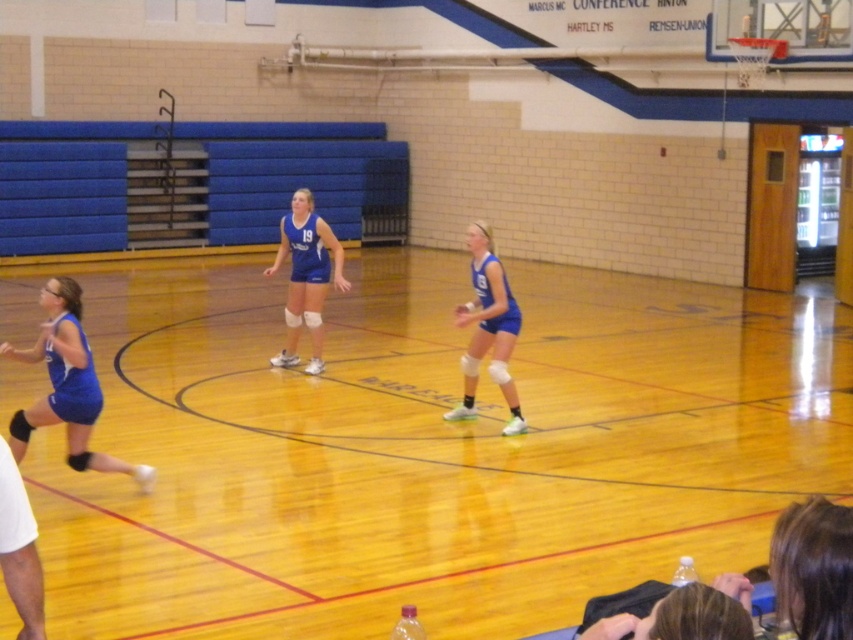
In the gymnasium where the volleyball game is happening, you notice two items of clothing. The first is the matte blue shorts at left, and the second is the blue matte volleyball uniform at center. Which of these items is wider?

The matte blue shorts at left is wider than the blue matte volleyball uniform at center.

You are a photographer standing at the back of the gymnasium, and you want to capture a photo of the blue matte volleyball player at center and the blue matte volleyball uniform at center. Which one will appear taller in the photo?

The blue matte volleyball player at center will appear taller in the photo because the blue matte volleyball player at center is much taller than the blue matte volleyball uniform at center.